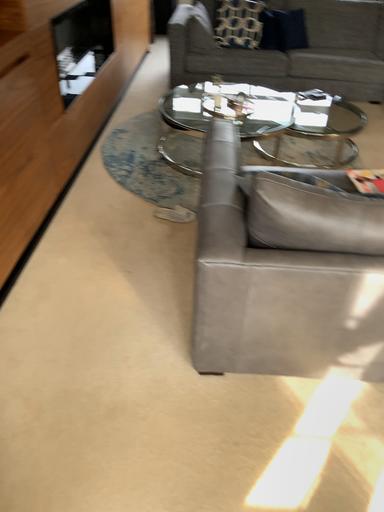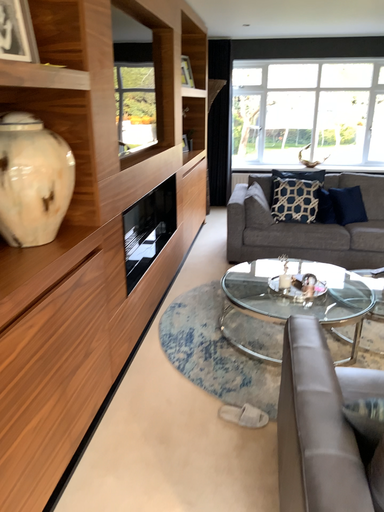
Question: How did the camera likely rotate when shooting the video?

Choices:
 (A) rotated upward
 (B) rotated downward

Answer: (A)